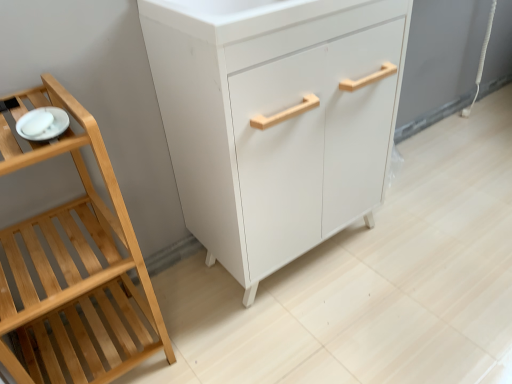
Question: Looking at their shapes, would you say white glossy plate at left is wider or thinner than white matte cabinet at center?

Choices:
 (A) wide
 (B) thin

Answer: (B)

Question: Considering the positions of white glossy plate at left and white matte cabinet at center in the image, is white glossy plate at left bigger or smaller than white matte cabinet at center?

Choices:
 (A) big
 (B) small

Answer: (B)

Question: Which of these objects is positioned farthest from the white glossy plate at left?

Choices:
 (A) natural wood shelf at left
 (B) white matte cabinet at center

Answer: (B)

Question: Considering the real-world distances, which object is closest to the white matte cabinet at center?

Choices:
 (A) natural wood shelf at left
 (B) white glossy plate at left

Answer: (A)